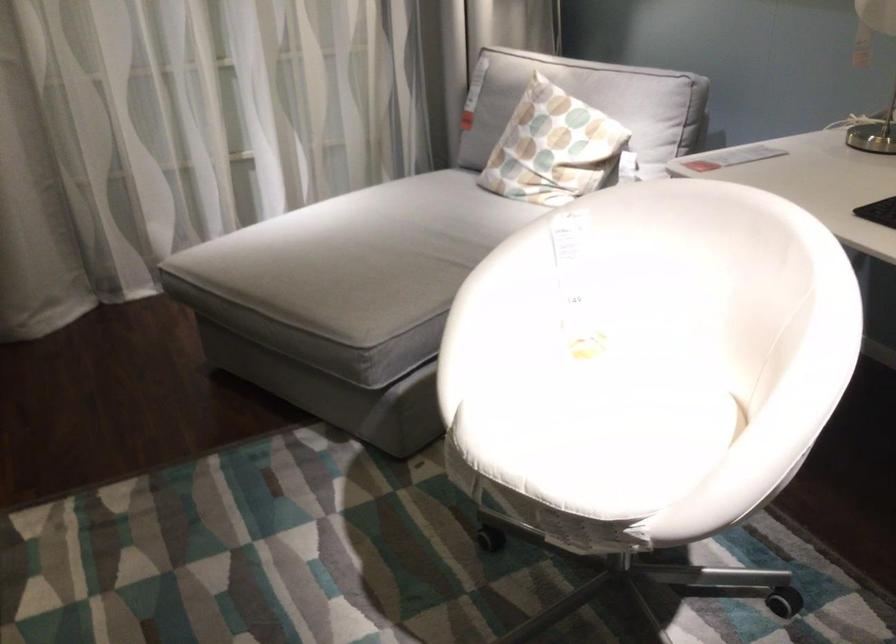
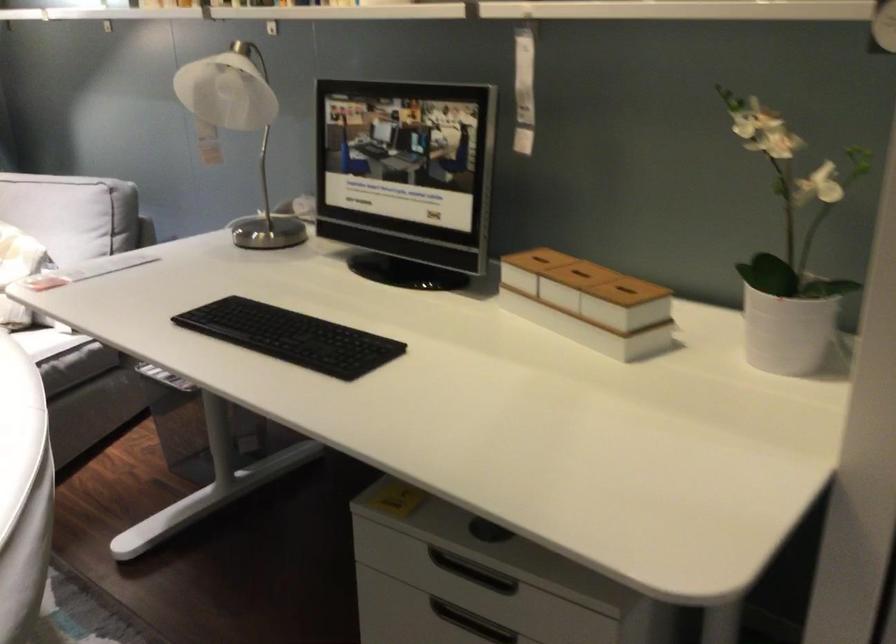
Question: The first image is from the beginning of the video and the second image is from the end. How did the camera likely rotate when shooting the video?

Choices:
 (A) Left
 (B) Right
 (C) Up
 (D) Down

Answer: (B)